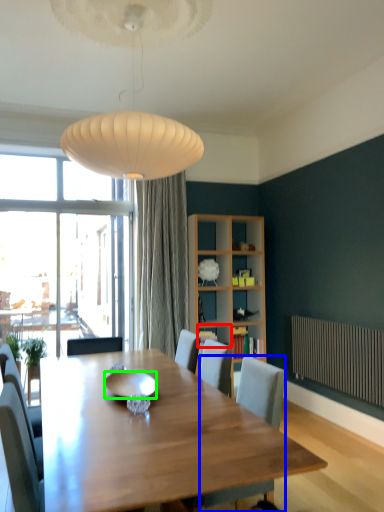
Question: Considering the real-world distances, which object is farthest from shelf (highlighted by a red box)? chair (highlighted by a blue box) or bowl (highlighted by a green box)?

Choices:
 (A) chair
 (B) bowl

Answer: (A)